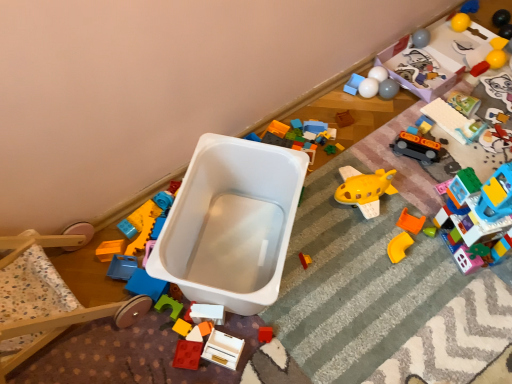
This screenshot has height=384, width=512. I want to click on blank space to the left of orange plastic block at lower right, the 7th toy when ordered from right to left, so click(x=356, y=230).